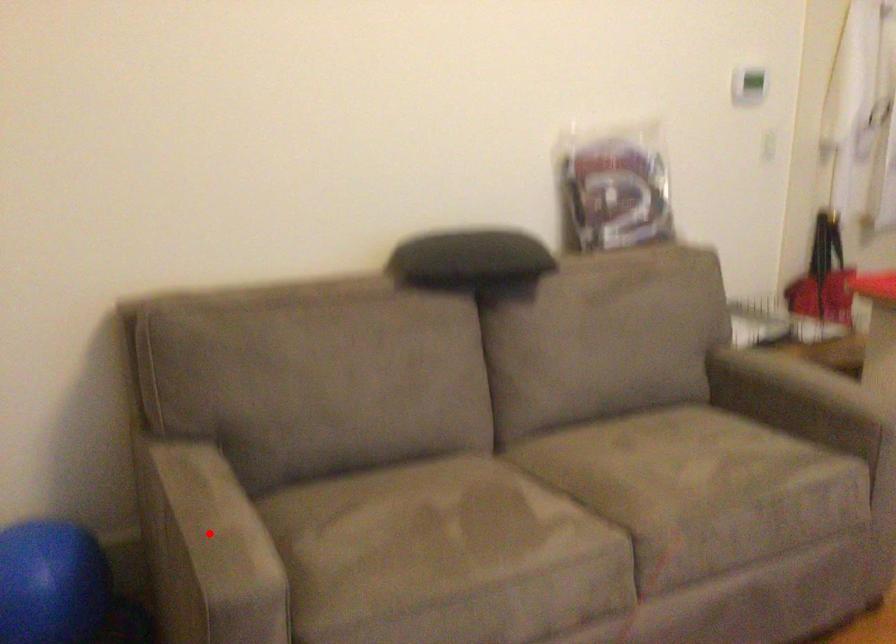
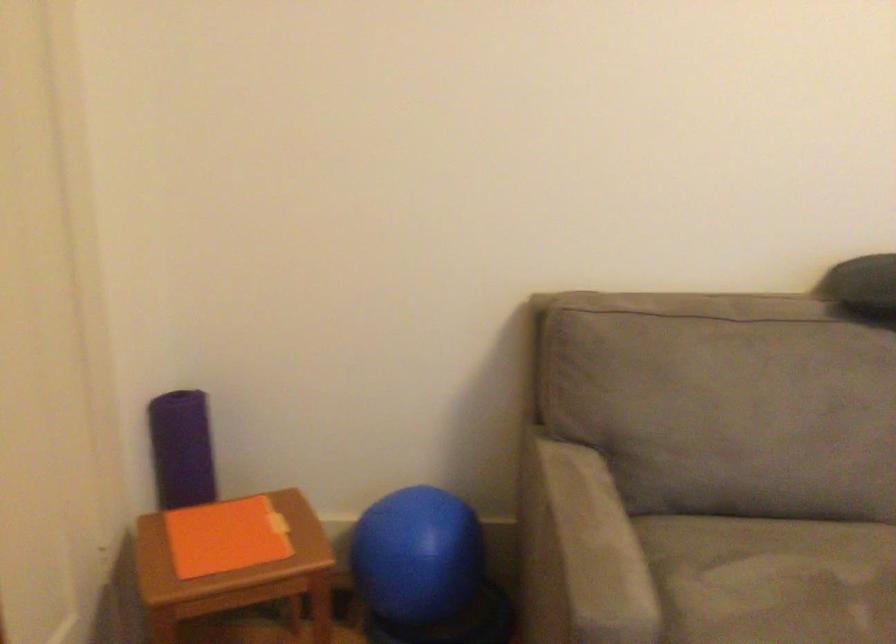
Find the pixel in the second image that matches the highlighted location in the first image.

(588, 550)